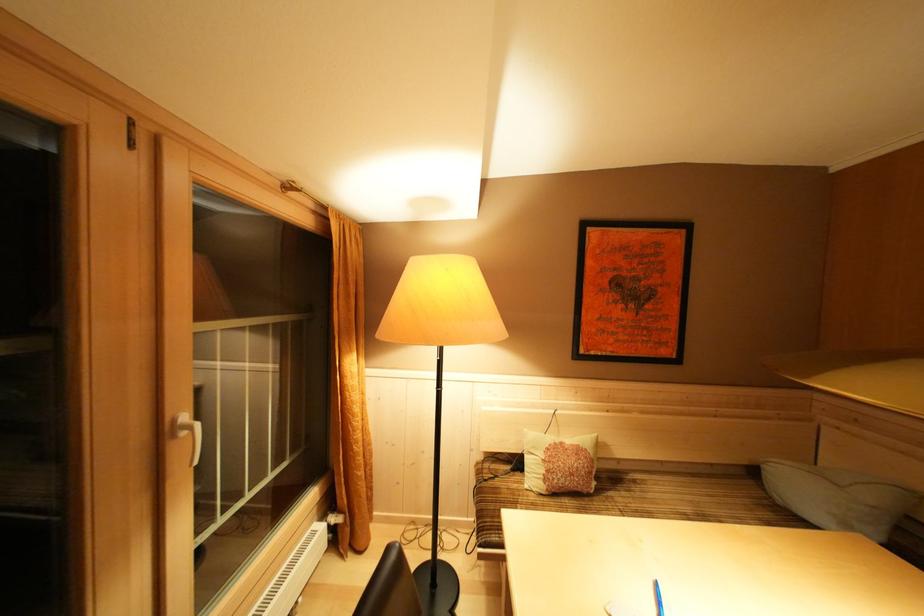
Find the location of `white window handle`. white window handle is located at coordinates (188, 434).